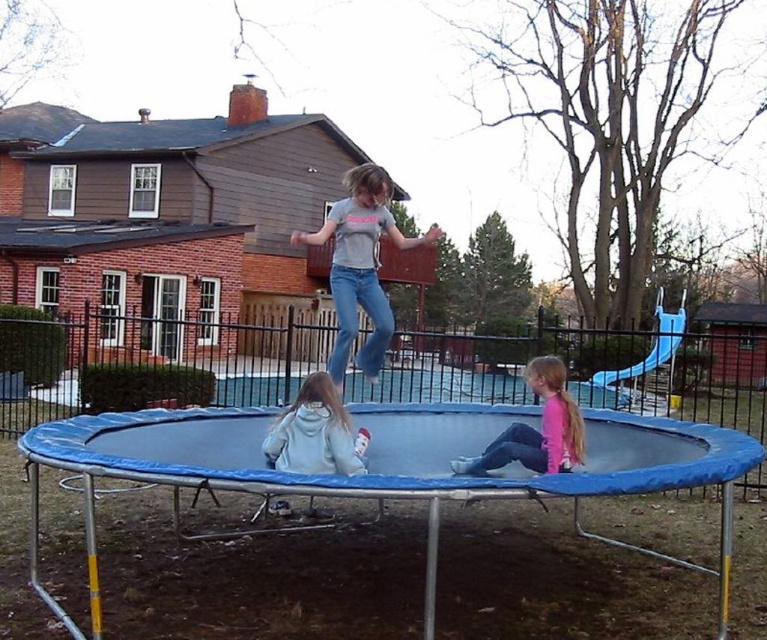
Is blue trampoline at center smaller than light gray hoodie at center?

Correct, blue trampoline at center occupies less space than light gray hoodie at center.

Is blue trampoline at center positioned in front of light gray hoodie at center?

No, it is behind light gray hoodie at center.

Between point (189, 566) and point (311, 400), which one is positioned in front?

Positioned in front is point (311, 400).

Identify the location of blue trampoline at center. (259, 573).

Does matte gray t-shirt at center have a greater width compared to light gray hoodie at center?

Yes.

Which is behind, point (364, 225) or point (308, 400)?

Point (364, 225)

Is point (425, 241) farther from camera compared to point (300, 396)?

Yes, it is behind point (300, 396).

The width and height of the screenshot is (767, 640). Find the location of `matte gray t-shirt at center`. matte gray t-shirt at center is located at coordinates (360, 266).

Does pink matte shirt at lower center have a greater width compared to light gray hoodie at center?

Indeed, pink matte shirt at lower center has a greater width compared to light gray hoodie at center.

Is pink matte shirt at lower center shorter than light gray hoodie at center?

No, pink matte shirt at lower center is not shorter than light gray hoodie at center.

Where is `pink matte shirt at lower center`? Image resolution: width=767 pixels, height=640 pixels. pink matte shirt at lower center is located at coordinates (535, 429).